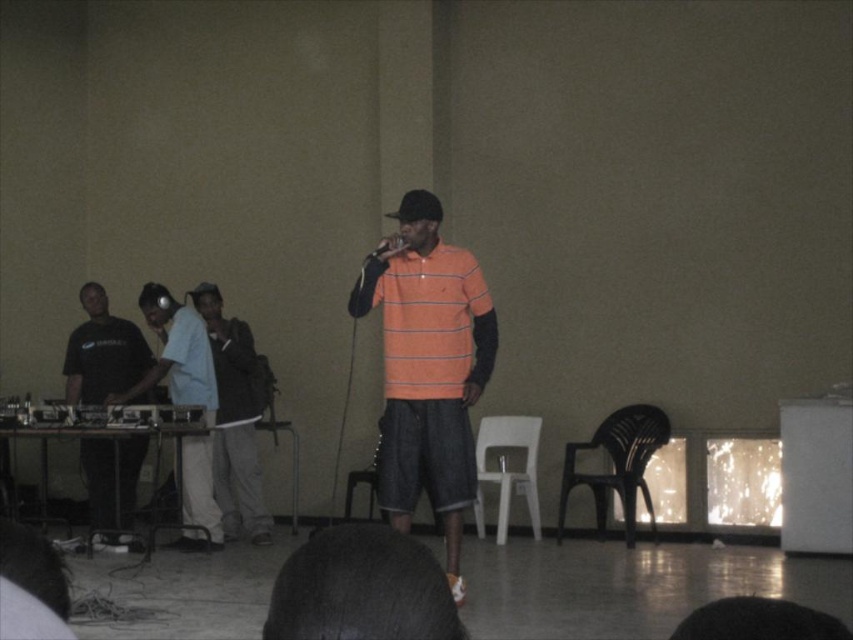
Between point (460, 369) and point (349, 483), which one is positioned behind?

Point (349, 483)

Does orange striped polo shirt at center have a smaller size compared to plastic chair at center?

No, orange striped polo shirt at center is not smaller than plastic chair at center.

Locate an element on the screen. orange striped polo shirt at center is located at coordinates (428, 371).

Does black matte dj controller at left have a greater height compared to black plastic chair at lower right?

Incorrect, black matte dj controller at left's height is not larger of black plastic chair at lower right's.

Consider the image. Can you confirm if black matte dj controller at left is positioned to the right of black plastic chair at lower right?

No, black matte dj controller at left is not to the right of black plastic chair at lower right.

Which is behind, point (112, 524) or point (610, 436)?

Positioned behind is point (610, 436).

You are a GUI agent. You are given a task and a screenshot of the screen. Output one action in this format:
    pyautogui.click(x=<x>, y=<y>)
    Task: Click on the black matte dj controller at left
    Image resolution: width=853 pixels, height=640 pixels.
    Given the screenshot: What is the action you would take?
    pyautogui.click(x=102, y=352)

You are a GUI agent. You are given a task and a screenshot of the screen. Output one action in this format:
    pyautogui.click(x=<x>, y=<y>)
    Task: Click on the black plastic chair at lower right
    
    Given the screenshot: What is the action you would take?
    pyautogui.click(x=618, y=465)

This screenshot has width=853, height=640. I want to click on black plastic chair at lower right, so (x=618, y=465).